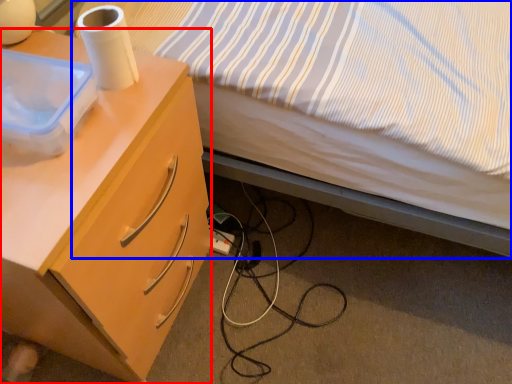
Question: Which object appears farthest to the camera in this image, desk (highlighted by a red box) or bed (highlighted by a blue box)?

Choices:
 (A) desk
 (B) bed

Answer: (A)